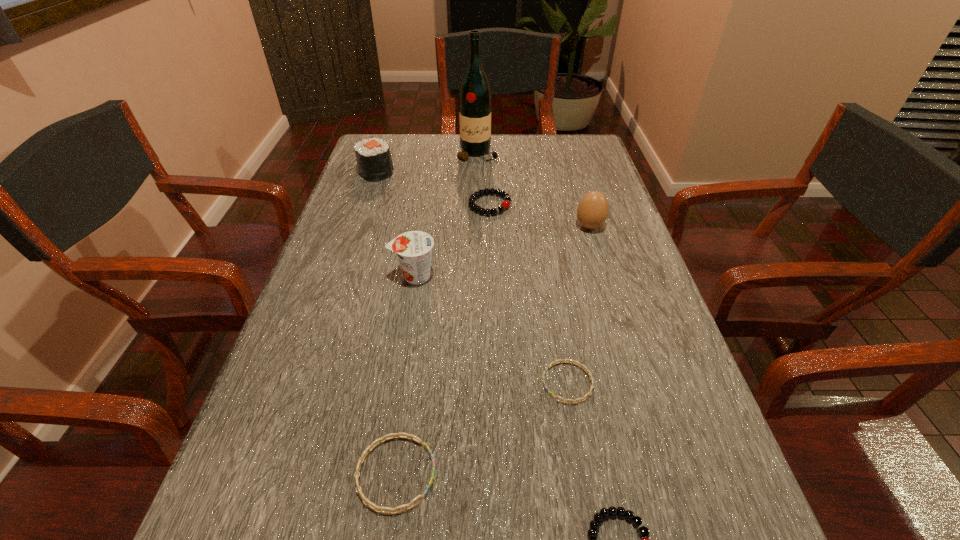
I want to click on free area in between the left black bracelet and the yogurt, so click(452, 240).

Select which object is the second closest to the smaller black bracelet. Please provide its 2D coordinates. Your answer should be formatted as a tuple, i.e. [(x, y)], where the tuple contains the x and y coordinates of a point satisfying the conditions above.

[(395, 435)]

Locate an element on the screen. object that is the fourth nearest to the yogurt is located at coordinates (592, 211).

Select which bracelet is the second closest to the bigger blue bracelet. Please provide its 2D coordinates. Your answer should be formatted as a tuple, i.e. [(x, y)], where the tuple contains the x and y coordinates of a point satisfying the conditions above.

[(604, 513)]

Locate which bracelet is the third closest to the shortest object. Please provide its 2D coordinates. Your answer should be formatted as a tuple, i.e. [(x, y)], where the tuple contains the x and y coordinates of a point satisfying the conditions above.

[(504, 205)]

Find the location of a particular element. free location that satisfies the following two spatial constraints: 1. on the surface of the brown boiled egg; 2. on the right side of the farthest object is located at coordinates (477, 226).